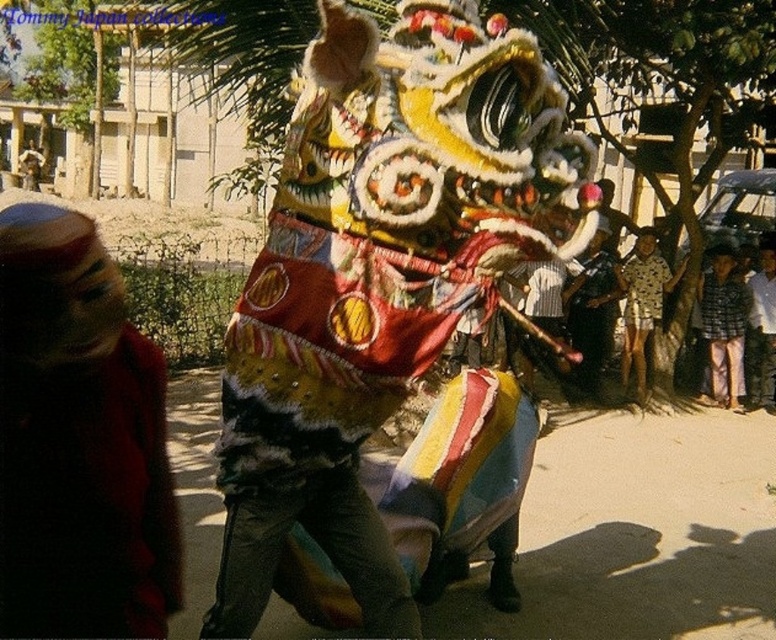
Question: Based on their relative distances, which object is nearer to the multicolored fabric lion head at center?

Choices:
 (A) plaid fabric shirt at right
 (B) printed cotton shirt at center

Answer: (B)

Question: Is red fabric headscarf at left above plaid fabric shirt at right?

Choices:
 (A) yes
 (B) no

Answer: (B)

Question: Is multicolored fabric lion head at center further to camera compared to printed cotton shirt at center?

Choices:
 (A) yes
 (B) no

Answer: (B)

Question: Which is nearer to the multicolored fabric lion head at center?

Choices:
 (A) red fabric headscarf at left
 (B) printed cotton shirt at center
 (C) plaid fabric shirt at right

Answer: (A)

Question: Which of the following is the farthest from the observer?

Choices:
 (A) multicolored fabric lion head at center
 (B) printed cotton shirt at center

Answer: (B)

Question: Can you confirm if multicolored fabric lion head at center is positioned above red fabric headscarf at left?

Choices:
 (A) yes
 (B) no

Answer: (A)